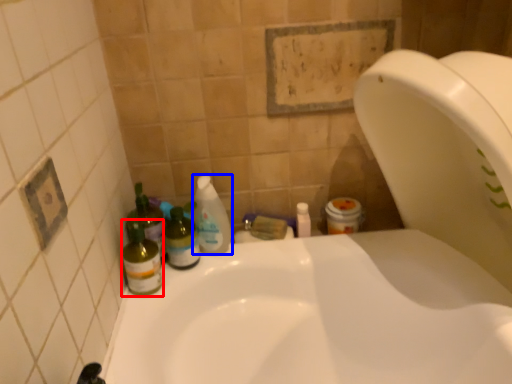
Question: Which object appears farthest to the camera in this image, bottle (highlighted by a red box) or cleaning product (highlighted by a blue box)?

Choices:
 (A) bottle
 (B) cleaning product

Answer: (B)